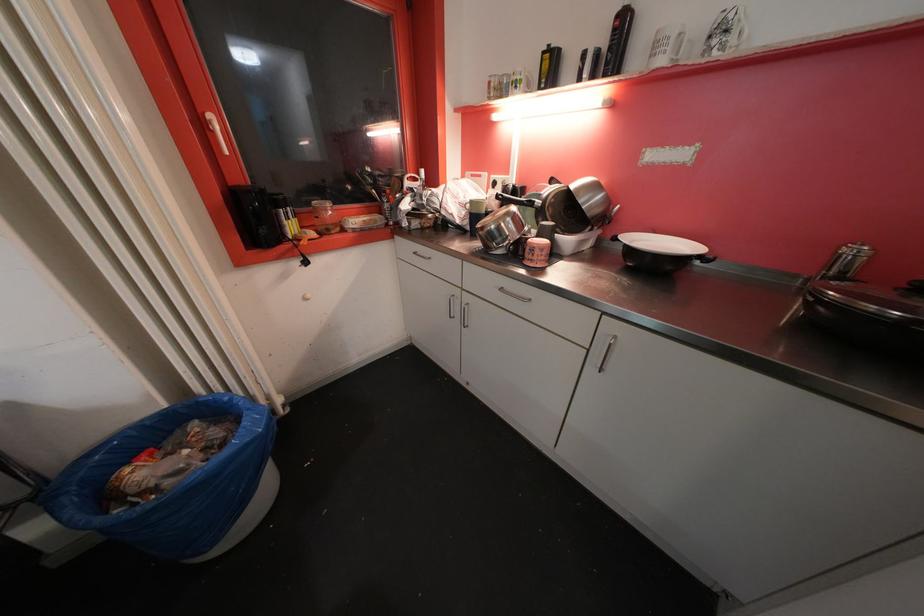
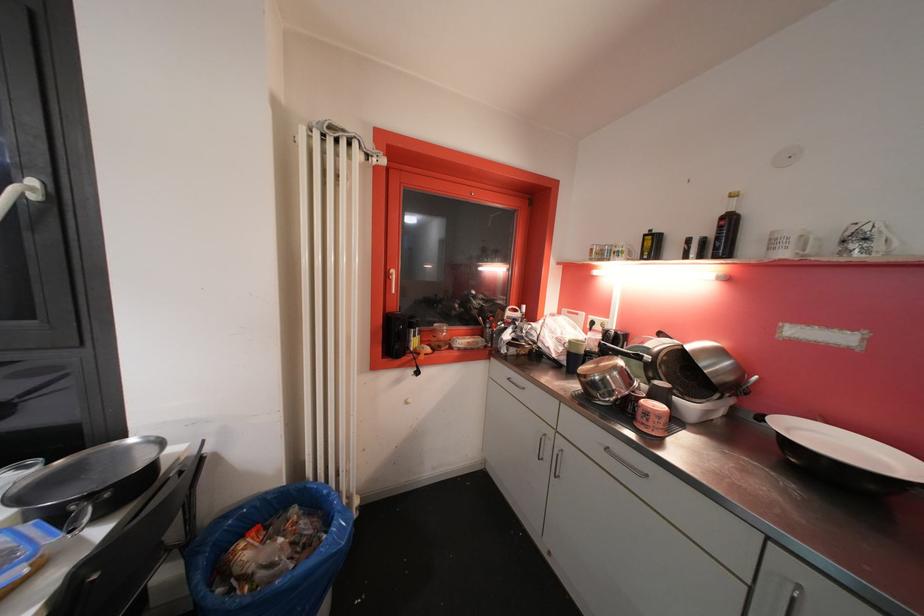
In a continuous first-person perspective shot, in which direction is the camera moving?

The cameraman walked toward left, backward.